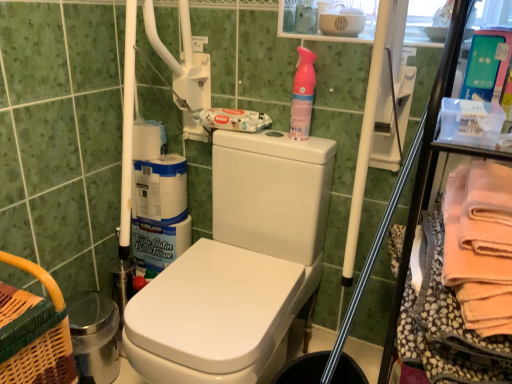
At what (x,y) coordinates should I click in order to perform the action: click on free location to the left of pink plastic spray bottle at upper right. Please return your answer as a coordinate pair (x, y). The height and width of the screenshot is (384, 512). Looking at the image, I should click on (264, 135).